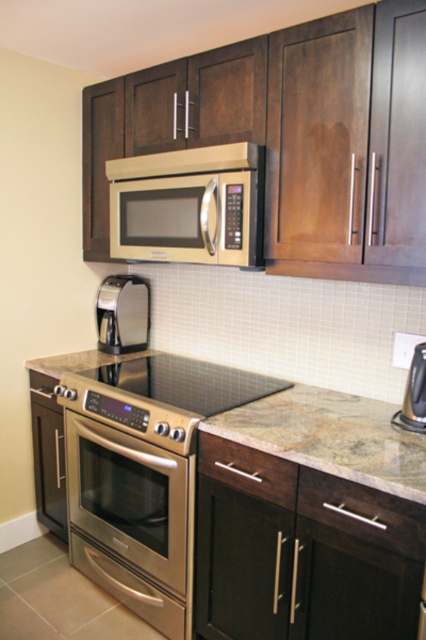
Does stainless steel oven at lower left have a greater height compared to satin gold microwave at upper center?

Indeed, stainless steel oven at lower left has a greater height compared to satin gold microwave at upper center.

Is point (104, 461) less distant than point (176, 200)?

No.

Identify the location of stainless steel oven at lower left. (132, 520).

Which of these two, marble/granite countertop at center or satin nickel coffee maker at center, stands taller?

Standing taller between the two is satin nickel coffee maker at center.

Is marble/granite countertop at center below satin nickel coffee maker at center?

Yes.

Is point (414, 467) in front of point (117, 300)?

Yes, it is.

Find the location of a particular element. This screenshot has width=426, height=640. marble/granite countertop at center is located at coordinates (331, 436).

The width and height of the screenshot is (426, 640). Identify the location of satin nickel coffee maker at center. (123, 314).

Between satin nickel coffee maker at center and satin black coffee maker at center, which one has more height?

satin nickel coffee maker at center is taller.

Between point (121, 280) and point (417, 381), which one is positioned behind?

Point (121, 280)

At what (x,y) coordinates should I click in order to perform the action: click on satin nickel coffee maker at center. Please return your answer as a coordinate pair (x, y). Looking at the image, I should click on 123,314.